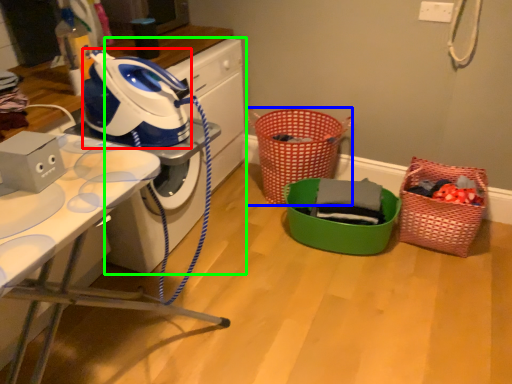
Question: Which object is the farthest from appliance (highlighted by a red box)? Choose among these: basket (highlighted by a blue box) or washing machine (highlighted by a green box).

Choices:
 (A) basket
 (B) washing machine

Answer: (A)